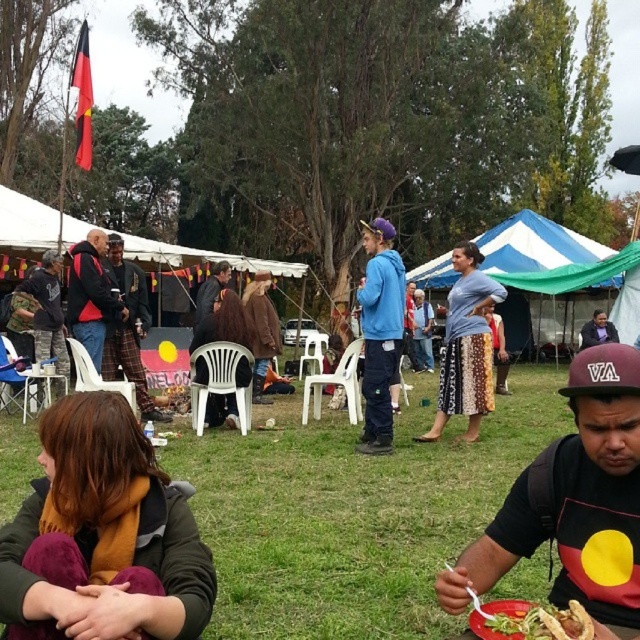
Between point (557, 612) and point (589, 336), which one is positioned behind?

The point (589, 336) is more distant.

Which is above, green leafy salad at lower center or dark blue fabric jacket at center?

dark blue fabric jacket at center is above.

Is point (536, 618) positioned behind point (595, 330)?

No, it is not.

The height and width of the screenshot is (640, 640). Find the location of `green leafy salad at lower center`. green leafy salad at lower center is located at coordinates (534, 620).

From the picture: Can you confirm if brown fuzzy coat at center is bigger than dark blue fabric jacket at center?

Yes.

Which is behind, point (220, 337) or point (614, 333)?

Point (614, 333)

The image size is (640, 640). What do you see at coordinates (224, 323) in the screenshot?
I see `brown fuzzy coat at center` at bounding box center [224, 323].

The width and height of the screenshot is (640, 640). I want to click on brown fuzzy coat at center, so click(224, 323).

Is point (468, 278) farther from viewer compared to point (109, 237)?

No, (468, 278) is in front of (109, 237).

Based on the photo, is patterned fabric skirt at center positioned before plaid fabric pants at center?

Yes, patterned fabric skirt at center is closer to the viewer.

Between point (416, 436) and point (125, 275), which one is positioned behind?

The point (125, 275) is behind.

Image resolution: width=640 pixels, height=640 pixels. I want to click on patterned fabric skirt at center, so click(x=467, y=346).